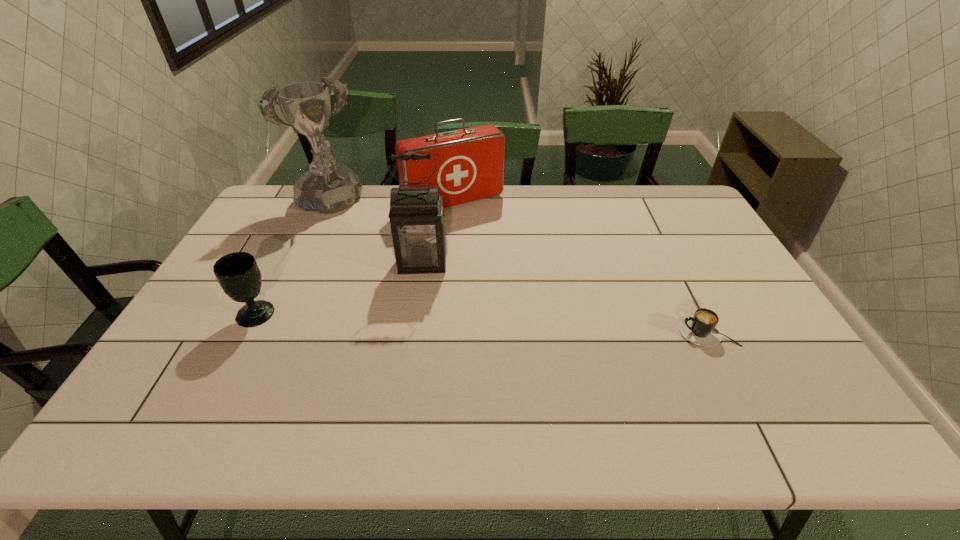
This screenshot has width=960, height=540. Identify the location of vacant space located with the handle on the side of the rightmost object. (617, 332).

Identify the location of free space located 0.280m on the front-facing side of the fourth shortest object. The height and width of the screenshot is (540, 960). point(417,352).

At what (x,y) coordinates should I click in order to perform the action: click on free space located 0.260m on the front-facing side of the fourth shortest object. Please return your answer as a coordinate pair (x, y). Image resolution: width=960 pixels, height=540 pixels. Looking at the image, I should click on (417, 346).

Locate an element on the screen. vacant space located 0.130m on the front-facing side of the fourth shortest object is located at coordinates (420, 308).

Where is `free location located on the side with emblem of the award`? The width and height of the screenshot is (960, 540). free location located on the side with emblem of the award is located at coordinates (349, 240).

Locate an element on the screen. blank space located on the side with emblem of the award is located at coordinates (372, 268).

Where is `vacant space located 0.370m on the side with emblem of the award`? The image size is (960, 540). vacant space located 0.370m on the side with emblem of the award is located at coordinates (386, 287).

In order to click on free location located 0.260m on the side of the first-aid kit with the first aid cross symbol in this screenshot , I will do `click(507, 262)`.

Where is `vacant space located 0.270m on the side of the first-aid kit with the first aid cross symbol`? The image size is (960, 540). vacant space located 0.270m on the side of the first-aid kit with the first aid cross symbol is located at coordinates click(509, 264).

Locate an element on the screen. The height and width of the screenshot is (540, 960). vacant space located 0.260m on the side of the first-aid kit with the first aid cross symbol is located at coordinates (507, 262).